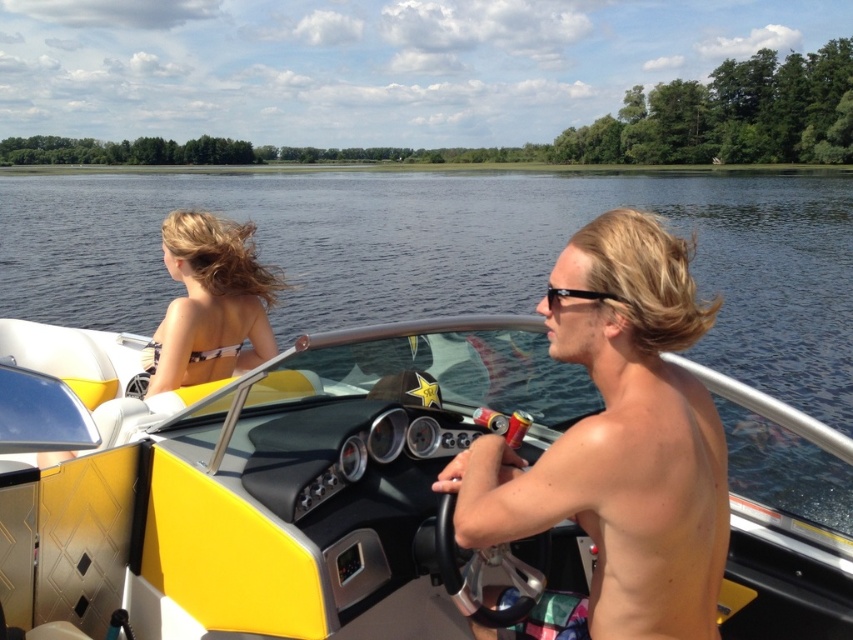
Can you confirm if shiny blonde hair at center is smaller than black plastic sunglasses at center?

Incorrect, shiny blonde hair at center is not smaller in size than black plastic sunglasses at center.

Is shiny blonde hair at center bigger than black plastic sunglasses at center?

Correct, shiny blonde hair at center is larger in size than black plastic sunglasses at center.

Is point (601, 262) positioned in front of point (572, 296)?

Yes, it is in front of point (572, 296).

Identify the location of shiny blonde hair at center. This screenshot has width=853, height=640. (618, 448).

Does yellow matte boat at center have a lesser height compared to black plastic sunglasses at center?

No, yellow matte boat at center is not shorter than black plastic sunglasses at center.

Which of these two, yellow matte boat at center or black plastic sunglasses at center, stands taller?

Standing taller between the two is yellow matte boat at center.

The image size is (853, 640). What do you see at coordinates (260, 481) in the screenshot?
I see `yellow matte boat at center` at bounding box center [260, 481].

I want to click on yellow matte boat at center, so click(x=260, y=481).

Based on the photo, can you confirm if shiny blonde hair at center is thinner than skinny tan skin at center?

No.

Which is more to the left, shiny blonde hair at center or skinny tan skin at center?

From the viewer's perspective, shiny blonde hair at center appears more on the left side.

The image size is (853, 640). Describe the element at coordinates (618, 448) in the screenshot. I see `shiny blonde hair at center` at that location.

The height and width of the screenshot is (640, 853). Identify the location of shiny blonde hair at center. (618, 448).